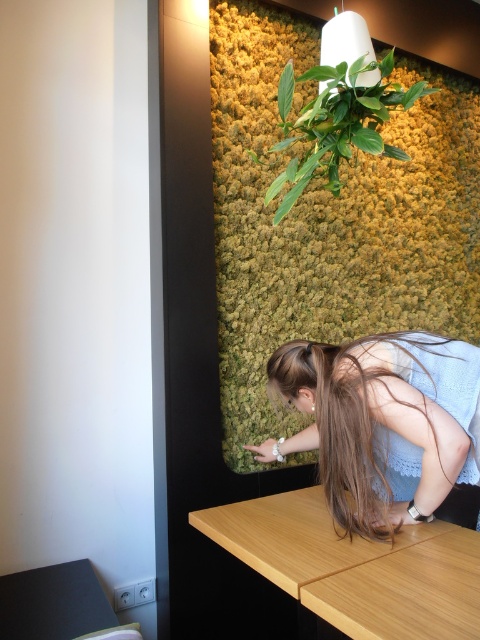
Between blue lace dress at center and green leafy plant at upper center, which one appears on the right side from the viewer's perspective?

Positioned to the right is blue lace dress at center.

Does blue lace dress at center appear on the left side of green leafy plant at upper center?

Incorrect, blue lace dress at center is not on the left side of green leafy plant at upper center.

What do you see at coordinates (384, 422) in the screenshot?
I see `blue lace dress at center` at bounding box center [384, 422].

Locate an element on the screen. blue lace dress at center is located at coordinates (384, 422).

Who is lower down, blue lace dress at center or light wood table at lower center?

light wood table at lower center

Who is positioned more to the right, blue lace dress at center or light wood table at lower center?

blue lace dress at center

This screenshot has height=640, width=480. Identify the location of blue lace dress at center. (384, 422).

Locate an element on the screen. This screenshot has width=480, height=640. blue lace dress at center is located at coordinates (384, 422).

Can you confirm if green leafy plant at upper center is positioned above smooth black table at lower left?

Yes.

Is point (351, 124) positioned behind point (16, 576)?

Yes.

Locate an element on the screen. The image size is (480, 640). green leafy plant at upper center is located at coordinates (336, 122).